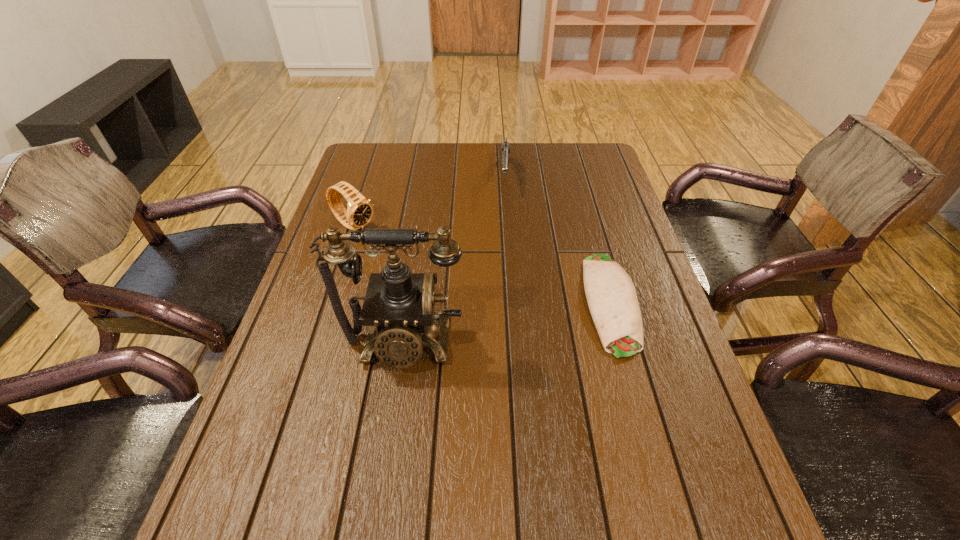
Locate an element on the screen. vacant space on the desktop that is between the telephone and the burrito and is positioned on the face of the watch is located at coordinates (512, 322).

Where is `free space on the desktop that is between the telephone and the rightmost object and is positioned aiming along the barrel of the gun`? This screenshot has height=540, width=960. free space on the desktop that is between the telephone and the rightmost object and is positioned aiming along the barrel of the gun is located at coordinates (498, 325).